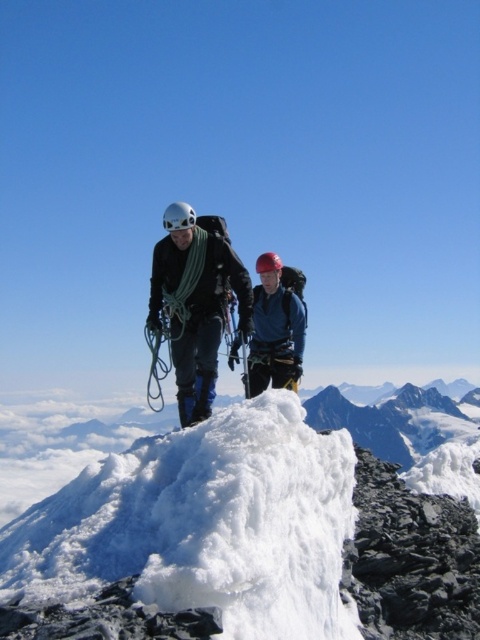
Question: From the image, what is the correct spatial relationship of white fluffy snow at center in relation to matte blue jacket at center?

Choices:
 (A) right
 (B) left

Answer: (A)

Question: Is white fluffy snow at center further to camera compared to matte black jacket at center?

Choices:
 (A) yes
 (B) no

Answer: (B)

Question: Among these points, which one is nearest to the camera?

Choices:
 (A) (180, 330)
 (B) (253, 442)
 (C) (255, 388)

Answer: (B)

Question: Is white fluffy snow at center below matte black jacket at center?

Choices:
 (A) yes
 (B) no

Answer: (A)

Question: Which point is farther to the camera?

Choices:
 (A) (430, 628)
 (B) (223, 280)

Answer: (B)

Question: Estimate the real-world distances between objects in this image. Which object is farther from the matte black jacket at center?

Choices:
 (A) matte blue jacket at center
 (B) white fluffy snow at center

Answer: (B)